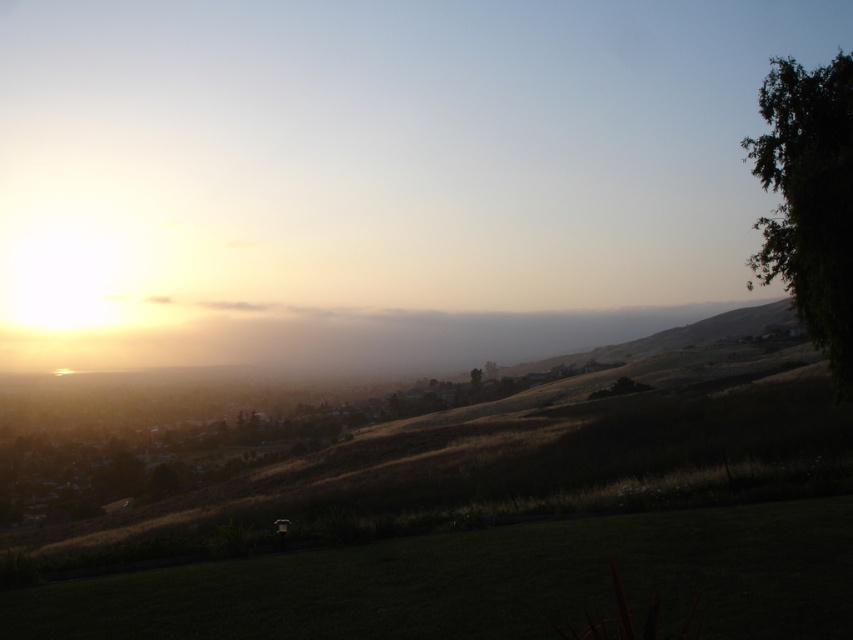
Is green grassy at lower center taller than green leafy tree at right?

Incorrect, green grassy at lower center's height is not larger of green leafy tree at right's.

Does green grassy at lower center appear over green leafy tree at right?

No, green grassy at lower center is not above green leafy tree at right.

Where is `green grassy at lower center`? Image resolution: width=853 pixels, height=640 pixels. green grassy at lower center is located at coordinates (485, 582).